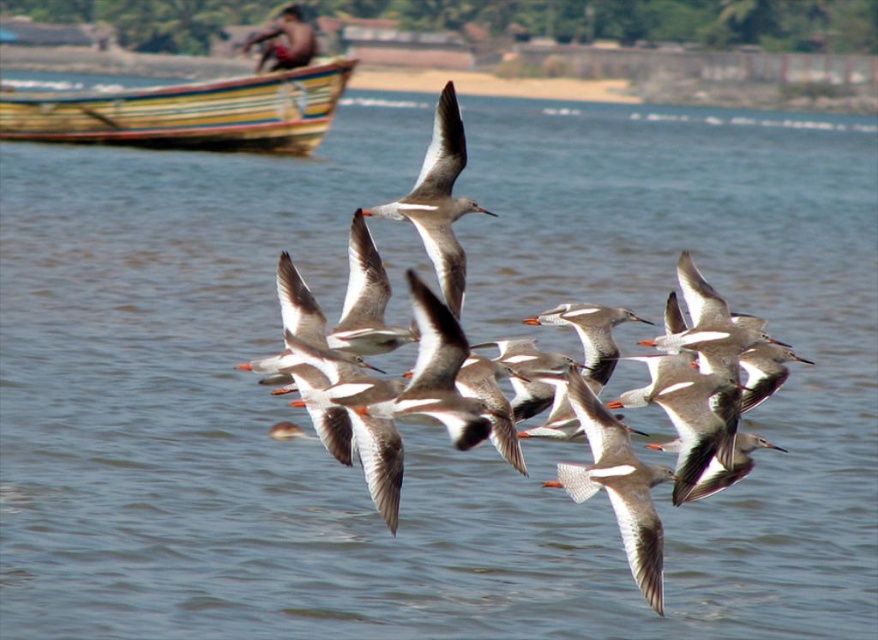
Question: Can you confirm if white feathered bird at center is thinner than white matte bird at center?

Choices:
 (A) no
 (B) yes

Answer: (B)

Question: Which object is closer to the camera taking this photo?

Choices:
 (A) white matte bird at center
 (B) white feathered bird at center

Answer: (B)

Question: Estimate the real-world distances between objects in this image. Which object is closer to the wooden painted boat at upper left?

Choices:
 (A) white feathered bird at center
 (B) white matte bird at center

Answer: (B)

Question: Is wooden painted boat at upper left to the right of white feathered bird at center from the viewer's perspective?

Choices:
 (A) no
 (B) yes

Answer: (A)

Question: Is wooden painted boat at upper left thinner than white feathered bird at center?

Choices:
 (A) no
 (B) yes

Answer: (A)

Question: Estimate the real-world distances between objects in this image. Which object is farther from the wooden painted boat at upper left?

Choices:
 (A) white matte bird at center
 (B) white feathered bird at center

Answer: (B)